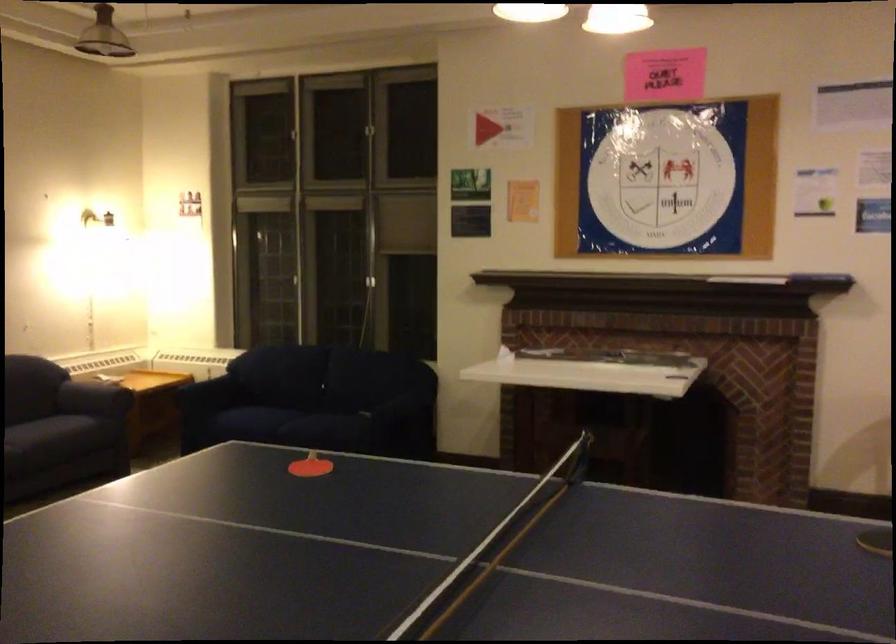
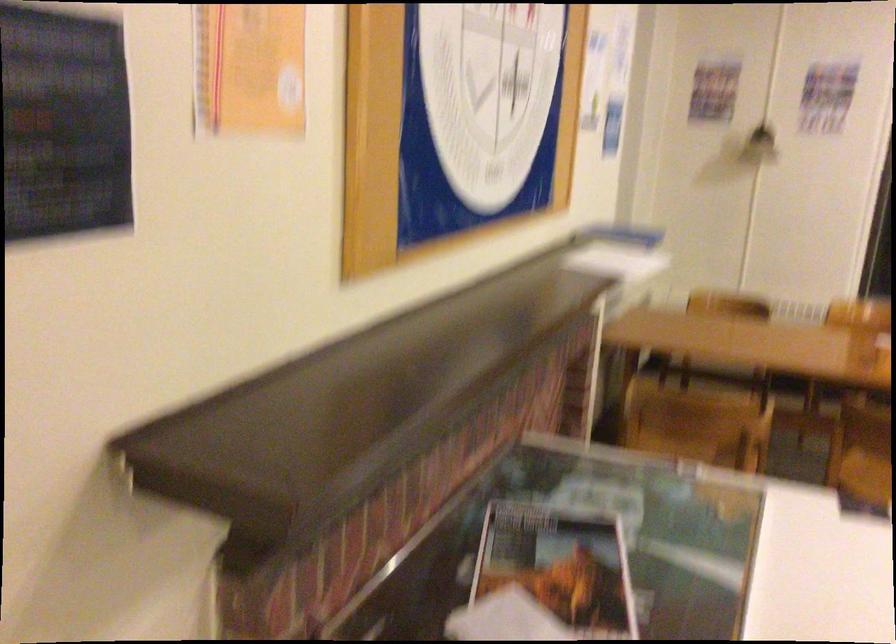
In the second image, find the point that corresponds to the point at 800,266 in the first image.

(617, 252)